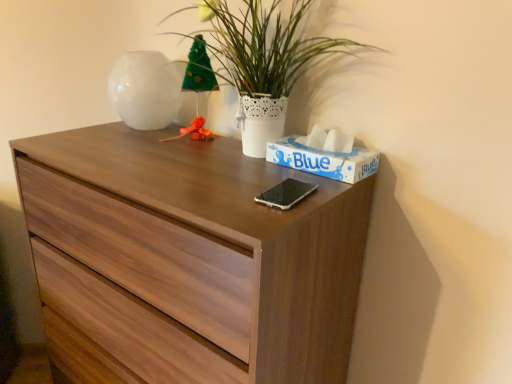
Find the location of a particular element. The image size is (512, 384). vacant space underneath white glossy vase at upper left (from a real-world perspective) is located at coordinates (131, 130).